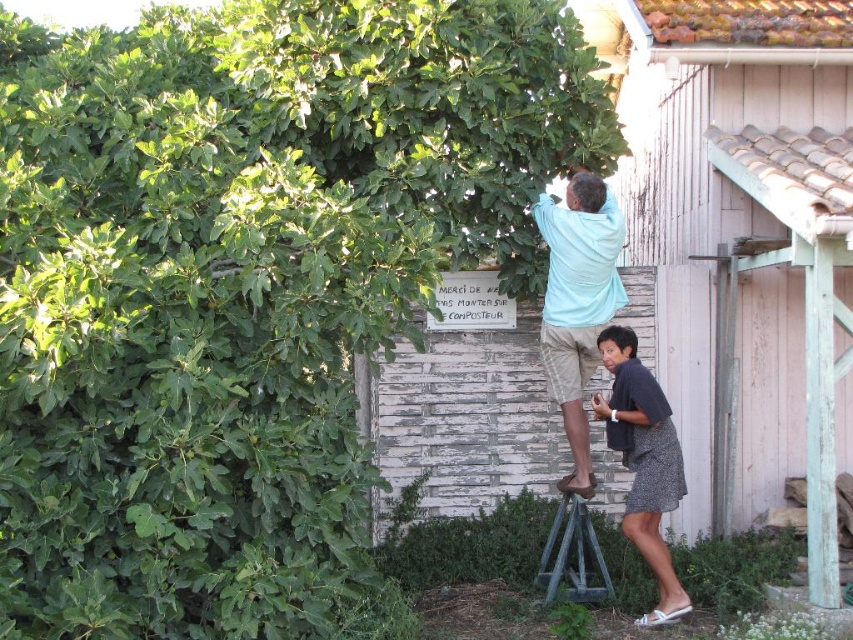
You are standing in the garden and see the point at coordinates (751, 224). Which object in the scene does this point belong to?

The point at coordinates (751, 224) belongs to the pink wood hut at upper right.

You are a fashion designer observing a garden scene. You notice a light blue cotton shirt at upper center and a dark gray textured dress at lower right. Can you determine if the distance between these two clothing items is sufficient for a person to comfortably walk between them without needing to adjust their position?

The distance between the light blue cotton shirt at upper center and the dark gray textured dress at lower right is 18.74 inches, which is approximately 1.56 feet. Since the average person requires about 2 feet of space to comfortably walk, the distance is insufficient for comfortable passage without adjustment.

You are standing in the garden and want to take a photo of both the green leafy tree at upper left and the light blue cotton shirt at upper center. Which object should you focus on first to ensure both are in clear view?

You should focus on the green leafy tree at upper left first since it is closer to you than the light blue cotton shirt at upper center, ensuring both will be in focus when focusing on the closer object first.